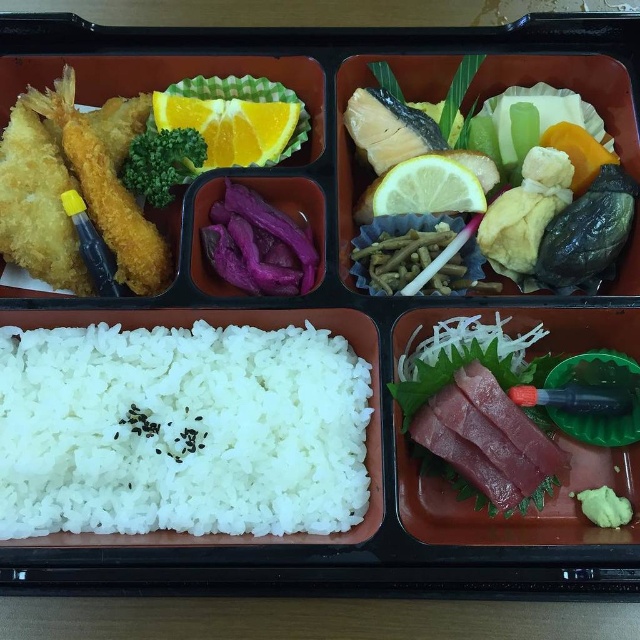
Who is positioned more to the right, sliced pinkish raw fish at bottom right or yellow matte lemon at center?

From the viewer's perspective, sliced pinkish raw fish at bottom right appears more on the right side.

Is sliced pinkish raw fish at bottom right to the left of yellow matte lemon at center from the viewer's perspective?

No, sliced pinkish raw fish at bottom right is not to the left of yellow matte lemon at center.

Find the location of a particular element. This screenshot has width=640, height=640. sliced pinkish raw fish at bottom right is located at coordinates (502, 445).

Does sliced pinkish raw fish at bottom right appear on the right side of purple matte pickled radish at center?

Correct, you'll find sliced pinkish raw fish at bottom right to the right of purple matte pickled radish at center.

Who is positioned more to the left, sliced pinkish raw fish at bottom right or purple matte pickled radish at center?

purple matte pickled radish at center

Between point (444, 428) and point (289, 282), which one is positioned behind?

Point (289, 282)

Where is `sliced pinkish raw fish at bottom right`? sliced pinkish raw fish at bottom right is located at coordinates (502, 445).

Is point (195, 376) in front of point (500, 324)?

Yes, it is.

Measure the distance between white matte rice at center and sliced pinkish raw fish at bottom right.

They are 13.13 inches apart.

Find the location of a particular element. Image resolution: width=640 pixels, height=640 pixels. white matte rice at center is located at coordinates (180, 429).